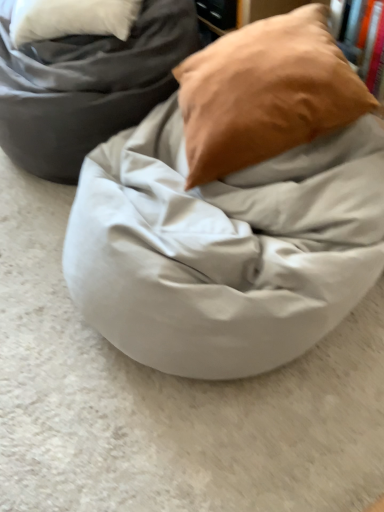
Question: Is matte gray bean bag at center located within matte brown pillow at upper right?

Choices:
 (A) no
 (B) yes

Answer: (A)

Question: Is matte brown pillow at upper right not inside matte gray bean bag at center?

Choices:
 (A) no
 (B) yes

Answer: (B)

Question: Does matte brown pillow at upper right appear on the left side of matte gray bean bag at center?

Choices:
 (A) no
 (B) yes

Answer: (A)

Question: From the image's perspective, is matte brown pillow at upper right over matte gray bean bag at center?

Choices:
 (A) no
 (B) yes

Answer: (A)

Question: Is matte brown pillow at upper right beside matte gray bean bag at center?

Choices:
 (A) yes
 (B) no

Answer: (B)

Question: Considering the relative sizes of matte brown pillow at upper right and matte gray bean bag at center in the image provided, is matte brown pillow at upper right thinner than matte gray bean bag at center?

Choices:
 (A) yes
 (B) no

Answer: (A)

Question: From the image's perspective, is matte white bean bag at center below matte brown pillow at upper right?

Choices:
 (A) no
 (B) yes

Answer: (B)

Question: Is matte white bean bag at center surrounding matte brown pillow at upper right?

Choices:
 (A) no
 (B) yes

Answer: (A)

Question: Is matte white bean bag at center facing towards matte brown pillow at upper right?

Choices:
 (A) yes
 (B) no

Answer: (B)

Question: Does matte white bean bag at center come in front of matte brown pillow at upper right?

Choices:
 (A) no
 (B) yes

Answer: (B)

Question: Is matte white bean bag at center smaller than matte brown pillow at upper right?

Choices:
 (A) no
 (B) yes

Answer: (A)

Question: Is matte white bean bag at center at the left side of matte brown pillow at upper right?

Choices:
 (A) yes
 (B) no

Answer: (A)

Question: Considering the relative sizes of matte gray bean bag at center and matte brown pillow at upper right in the image provided, is matte gray bean bag at center smaller than matte brown pillow at upper right?

Choices:
 (A) no
 (B) yes

Answer: (A)